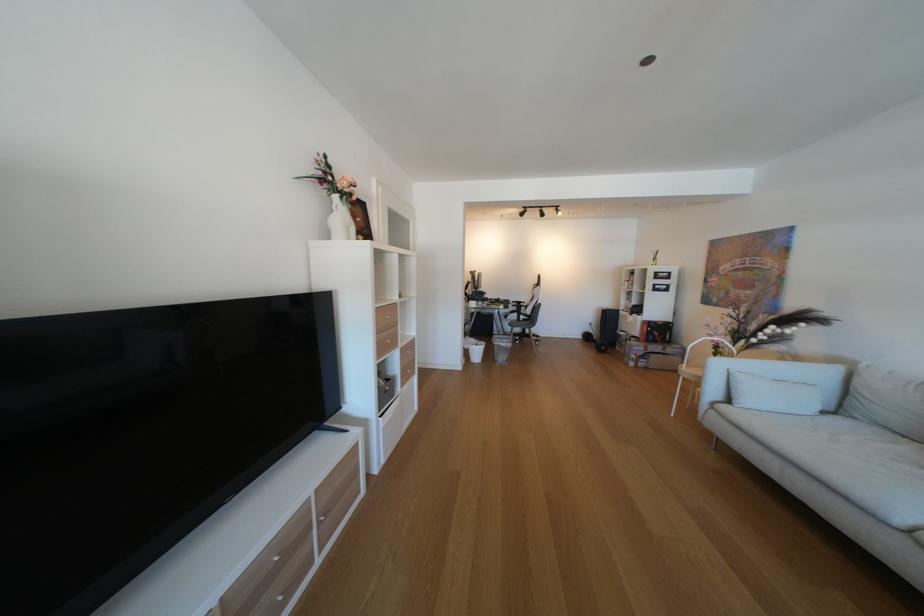
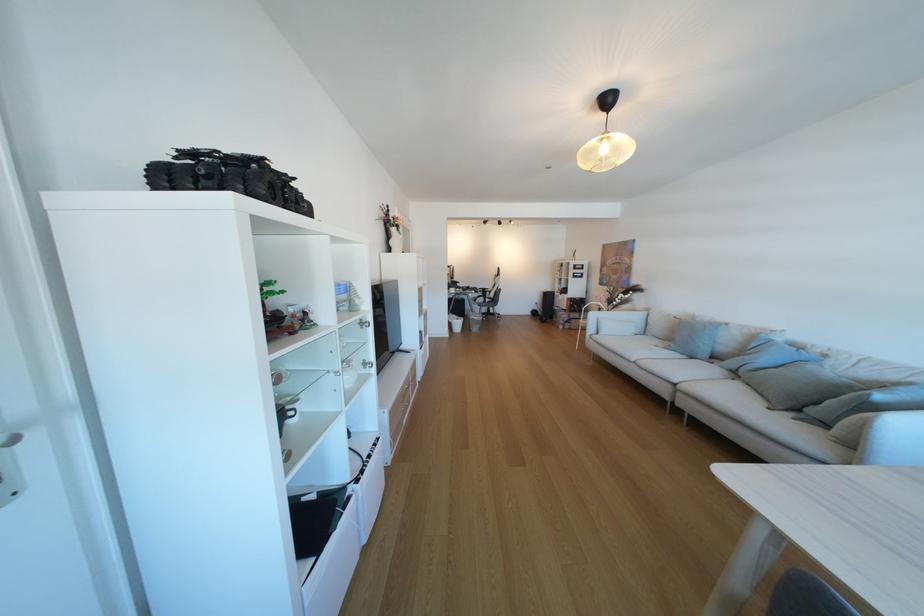
In the second image, find the point that corresponds to (x=670, y=341) in the first image.

(589, 310)